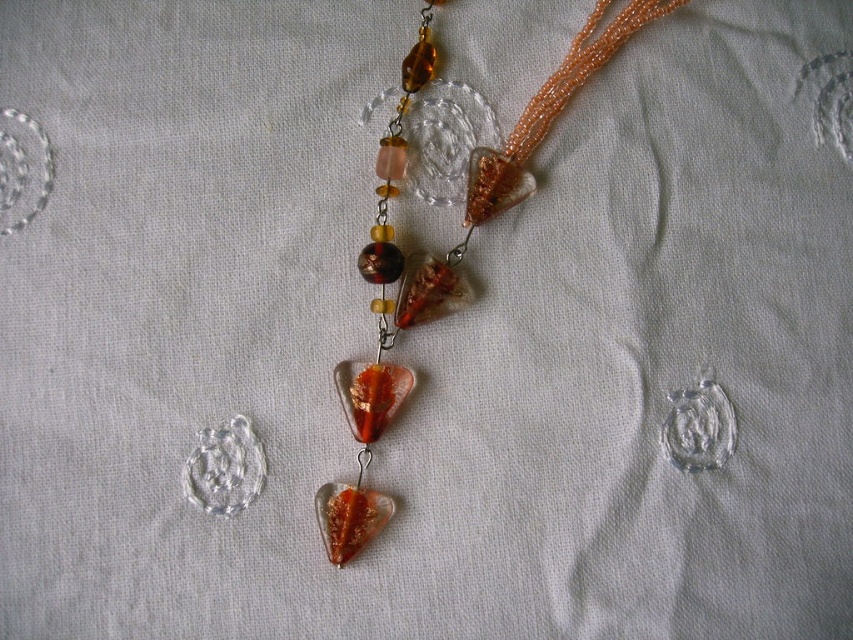
You are a GUI agent. You are given a task and a screenshot of the screen. Output one action in this format:
    pyautogui.click(x=<x>, y=<y>)
    Task: Click on the translucent amber glass pendant at center
    The width and height of the screenshot is (853, 640).
    Given the screenshot: What is the action you would take?
    pyautogui.click(x=444, y=253)

Is translucent amber glass pendant at center behind translucent amber glass heart at center?

Yes, translucent amber glass pendant at center is further from the viewer.

Is point (347, 413) closer to viewer compared to point (343, 387)?

Yes, it is in front of point (343, 387).

Where is `translucent amber glass pendant at center`? translucent amber glass pendant at center is located at coordinates pos(444,253).